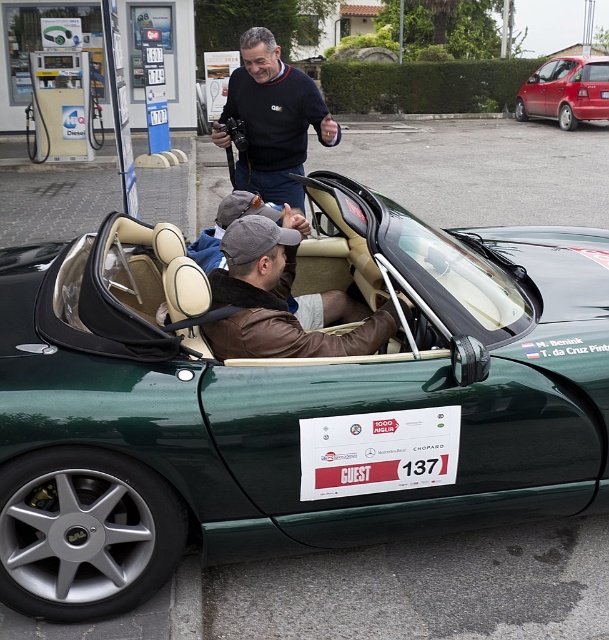
Is point (373, 321) closer to camera compared to point (303, 454)?

No, (373, 321) is behind (303, 454).

Who is lower down, brown leather jacket at center or white paper sign at center?

white paper sign at center

Does point (236, 268) lie in front of point (350, 472)?

No, (236, 268) is behind (350, 472).

You are a GUI agent. You are given a task and a screenshot of the screen. Output one action in this format:
    pyautogui.click(x=<x>, y=<y>)
    Task: Click on the brown leather jacket at center
    The height and width of the screenshot is (640, 609).
    Given the screenshot: What is the action you would take?
    pyautogui.click(x=280, y=300)

This screenshot has width=609, height=640. Describe the element at coordinates (289, 401) in the screenshot. I see `green leather convertible at center` at that location.

Between green leather convertible at center and metallic red hatchback at upper right, which one has more height?

Standing taller between the two is metallic red hatchback at upper right.

What do you see at coordinates (289, 401) in the screenshot? I see `green leather convertible at center` at bounding box center [289, 401].

Where is `green leather convertible at center`? The image size is (609, 640). green leather convertible at center is located at coordinates (289, 401).

Can you confirm if brown leather jacket at center is smaller than matte black sweater at center?

Yes.

Which of these two, brown leather jacket at center or matte black sweater at center, stands taller?

With more height is matte black sweater at center.

Where is `brown leather jacket at center`? The height and width of the screenshot is (640, 609). brown leather jacket at center is located at coordinates (280, 300).